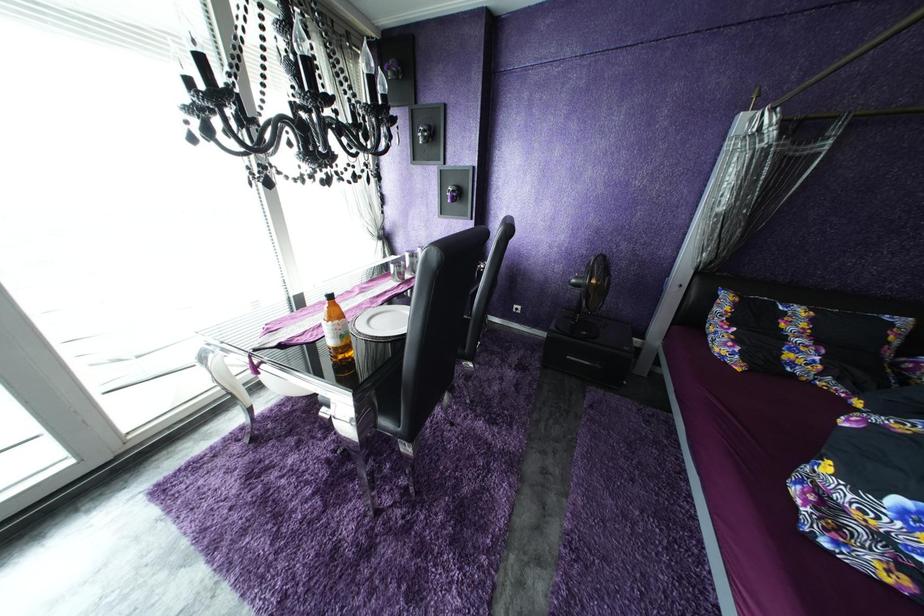
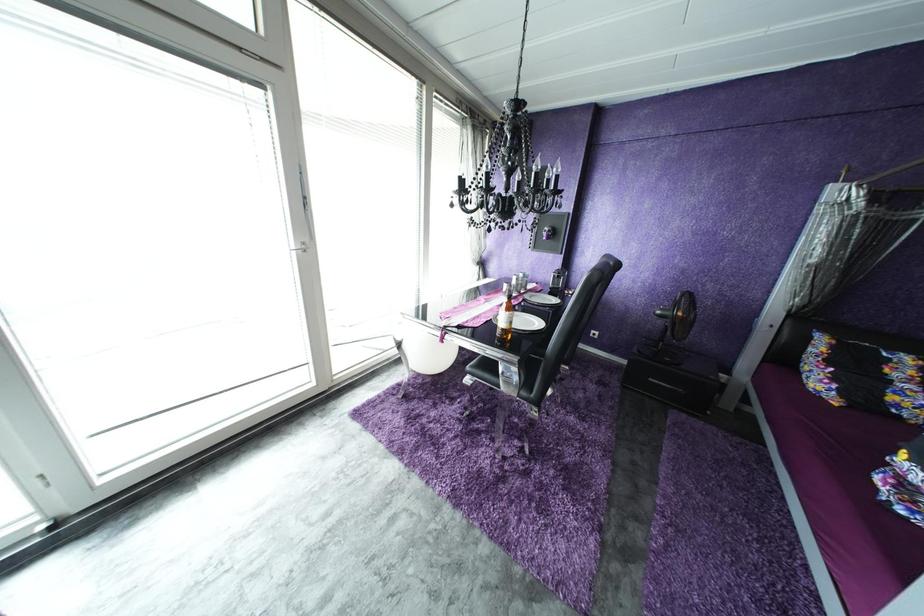
Which direction would the cameraman need to move to produce the second image?

The movement direction of the cameraman is left, backward.